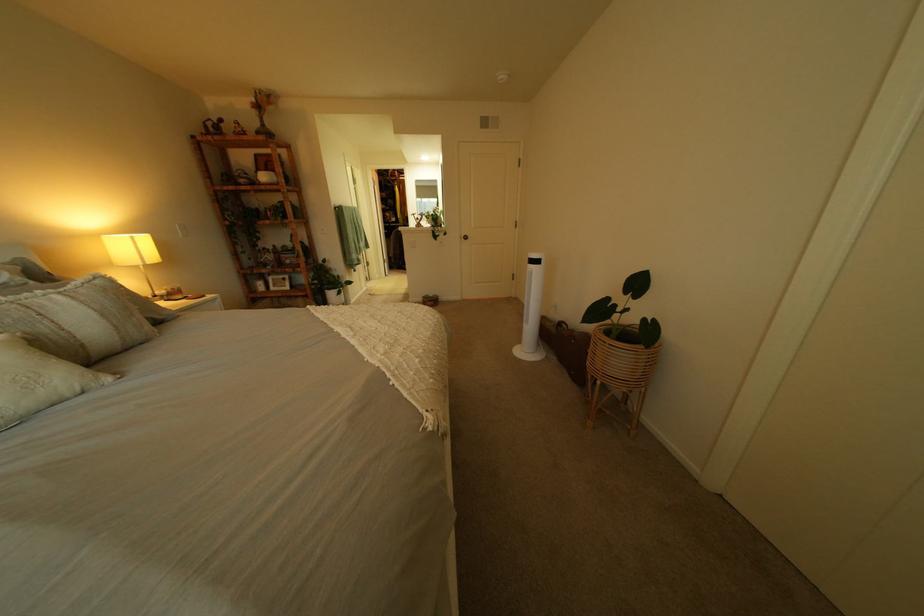
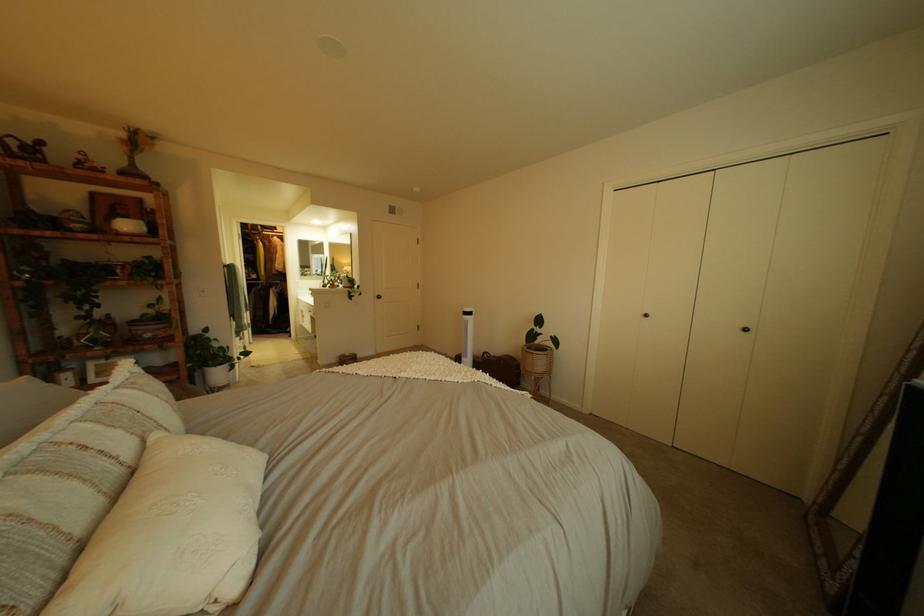
In the second image, find the point that corresponds to [269,100] in the first image.

(139, 137)